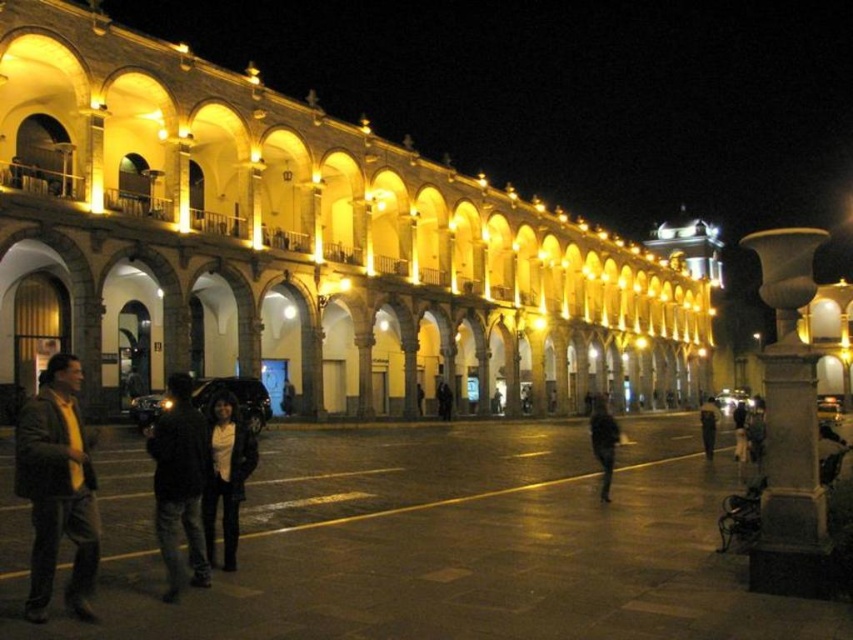
Question: Is matte yellow shirt at left bigger than dark gray jacket at lower right?

Choices:
 (A) yes
 (B) no

Answer: (B)

Question: Among these points, which one is farthest from the camera?

Choices:
 (A) (593, 444)
 (B) (167, 387)

Answer: (B)

Question: Considering the relative positions of dark brown leather jacket at center and dark gray jacket at lower right in the image provided, where is dark brown leather jacket at center located with respect to dark gray jacket at lower right?

Choices:
 (A) below
 (B) above

Answer: (B)

Question: Which of these objects is positioned closest to the black matte person at center?

Choices:
 (A) dark blue jeans at center
 (B) white stone column at right
 (C) dark brown leather jacket at center

Answer: (C)

Question: Is white stone column at right positioned behind dark brown leather jacket at center?

Choices:
 (A) yes
 (B) no

Answer: (B)

Question: Which object appears closest to the camera in this image?

Choices:
 (A) dark gray jacket at lower right
 (B) black matte person at center
 (C) white stone column at right
 (D) dark brown leather jacket at center

Answer: (C)